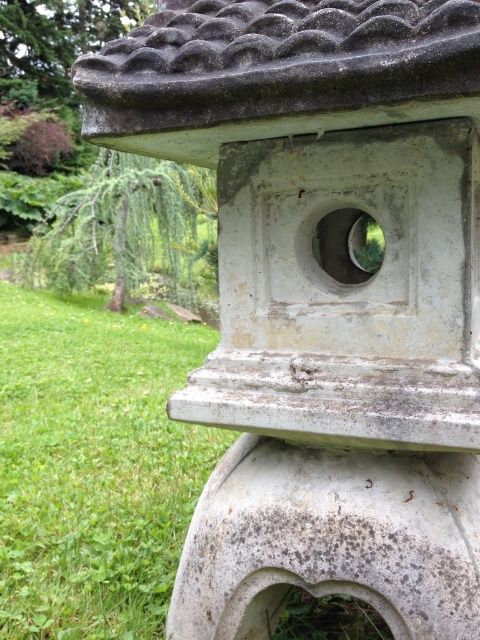
Question: Is green grass at lower left to the right of gray stone lantern at center from the viewer's perspective?

Choices:
 (A) no
 (B) yes

Answer: (A)

Question: Is green grass at lower left to the right of gray stone lantern at center from the viewer's perspective?

Choices:
 (A) yes
 (B) no

Answer: (B)

Question: Is green grass at lower left wider than gray stone lantern at center?

Choices:
 (A) yes
 (B) no

Answer: (B)